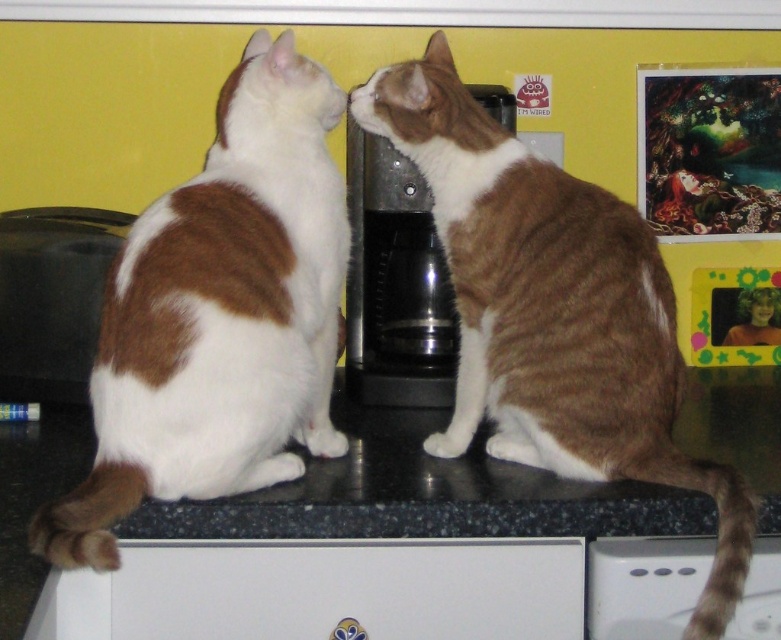
From the picture: You are a cat owner trying to separate your two cats to prevent them from fighting. You see the brown and white fur cat at left and the brown and white fur cat at center. Which cat should you move to the right side of the countertop to create space between them?

The brown and white fur cat at left is positioned over the brown and white fur cat at center. To create space between them, you should move the brown and white fur cat at left to the right side of the countertop.

You are a cat lover who wants to take a photo of the brown and white fur cat at left and the black plastic coffee machine at center. To ensure both are in the frame, where should you position the camera relative to the cats?

The brown and white fur cat at left is below the black plastic coffee machine at center, so you should position the camera above the cats to capture both in the frame.